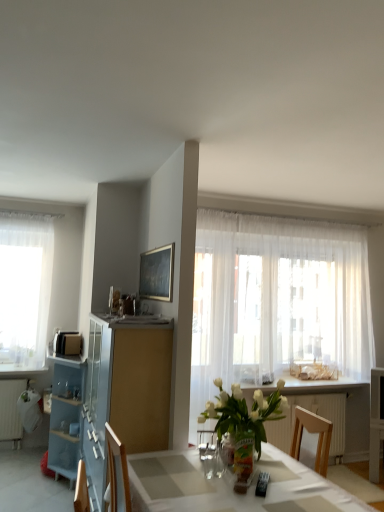
Identify the location of vacant region above white matte radiator at lower left, which appears as the second radiator when viewed from the right (from a real-world perspective). (19, 375).